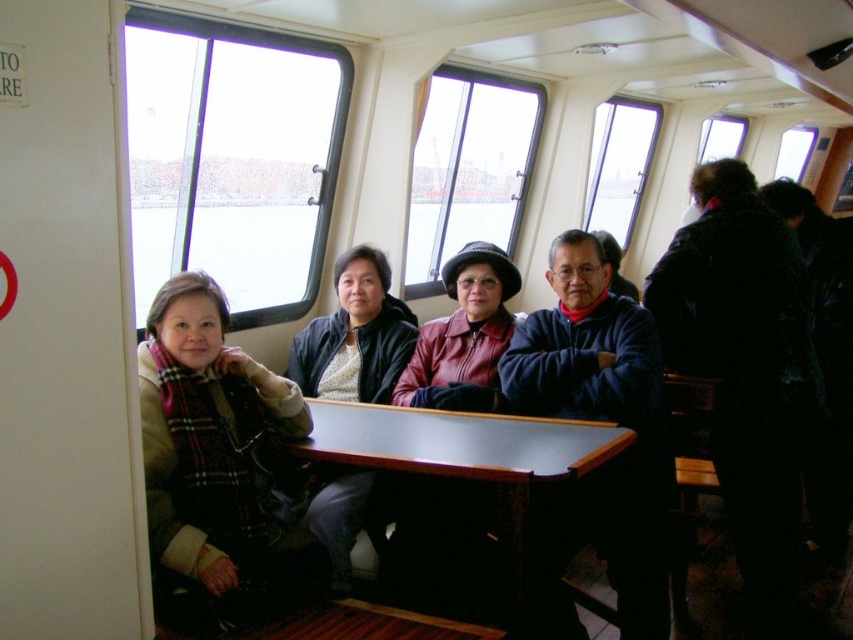
Question: Which of the following is the farthest from the observer?

Choices:
 (A) black wood table at center
 (B) blue fleece jacket at center
 (C) black matte jacket at center

Answer: (C)

Question: Is black fuzzy coat at upper right to the left of leather jacket at center from the viewer's perspective?

Choices:
 (A) no
 (B) yes

Answer: (A)

Question: Where is black fuzzy coat at upper right located in relation to black matte jacket at center in the image?

Choices:
 (A) right
 (B) left

Answer: (A)

Question: Which object is positioned closest to the black matte jacket at center?

Choices:
 (A) leather jacket at center
 (B) plaid scarf at left
 (C) blue fleece jacket at center

Answer: (A)

Question: Among these points, which one is nearest to the camera?

Choices:
 (A) (608, 472)
 (B) (341, 422)

Answer: (A)

Question: Does plaid scarf at left lie in front of black wood table at center?

Choices:
 (A) yes
 (B) no

Answer: (B)